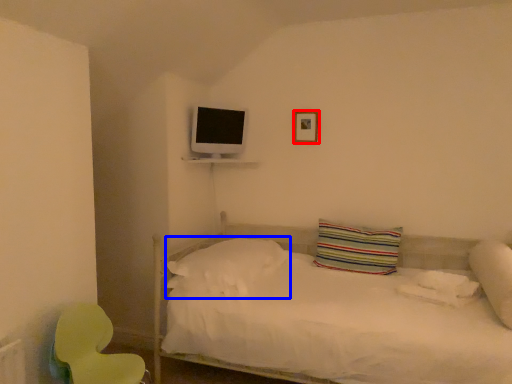
Question: Which point is closer to the camera, picture frame (highlighted by a red box) or pillow (highlighted by a blue box)?

Choices:
 (A) picture frame
 (B) pillow

Answer: (B)